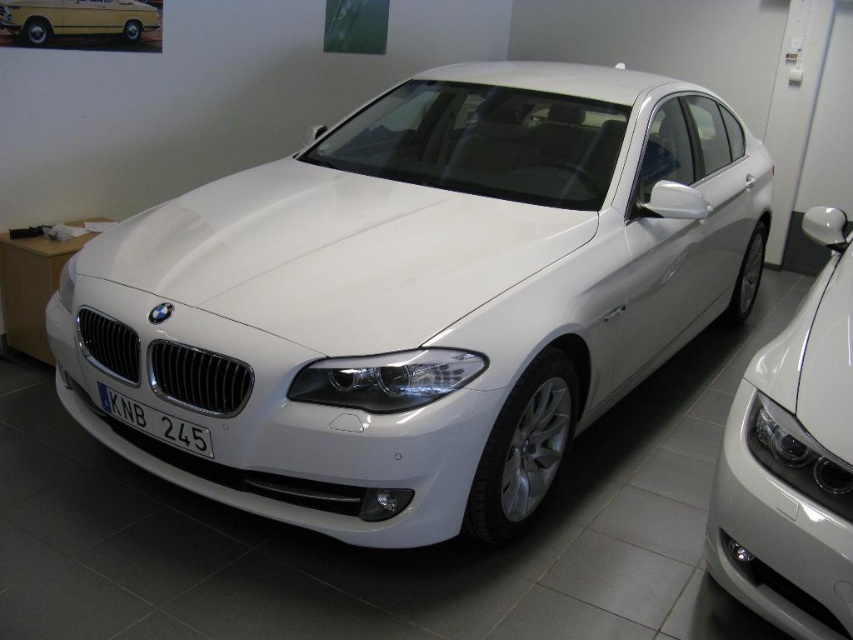
Question: Estimate the real-world distances between objects in this image. Which object is closer to the white plastic license plate at center?

Choices:
 (A) yellow matte car at upper left
 (B) white metallic car at center

Answer: (B)

Question: Is white metallic car at center thinner than white plastic license plate at center?

Choices:
 (A) no
 (B) yes

Answer: (A)

Question: Which point is closer to the camera?

Choices:
 (A) (122, 6)
 (B) (241, 300)
 (C) (120, 394)

Answer: (B)

Question: Which object is positioned farthest from the glossy white car at right?

Choices:
 (A) white metallic car at center
 (B) white plastic license plate at center

Answer: (B)

Question: Is yellow matte car at upper left below white plastic license plate at center?

Choices:
 (A) yes
 (B) no

Answer: (B)

Question: From the image, what is the correct spatial relationship of yellow matte car at upper left in relation to white plastic license plate at center?

Choices:
 (A) right
 (B) left

Answer: (B)